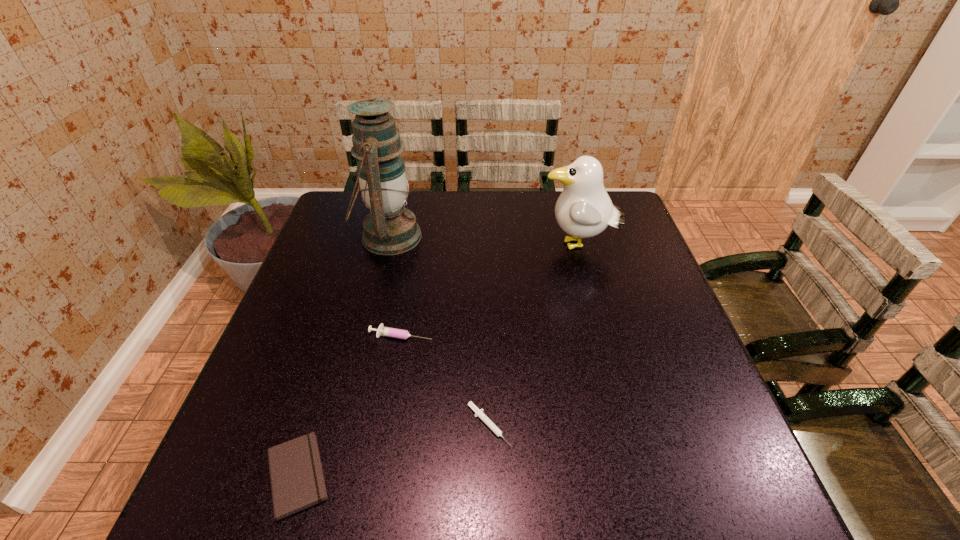
The height and width of the screenshot is (540, 960). In order to click on object present at the right edge in this screenshot , I will do `click(584, 209)`.

The height and width of the screenshot is (540, 960). Identify the location of object positioned at the far left corner. (389, 229).

This screenshot has height=540, width=960. Find the location of `object present at the near left corner`. object present at the near left corner is located at coordinates (297, 482).

The image size is (960, 540). In order to click on object at the far right corner in this screenshot , I will do `click(584, 209)`.

Where is `free space at the far edge`? The height and width of the screenshot is (540, 960). free space at the far edge is located at coordinates [456, 230].

Locate an element on the screen. The image size is (960, 540). vacant space at the left edge of the desktop is located at coordinates (329, 242).

Locate an element on the screen. vacant space at the right edge is located at coordinates (675, 381).

Locate an element on the screen. The height and width of the screenshot is (540, 960). vacant space at the far left corner of the desktop is located at coordinates (333, 214).

What are the coordinates of `free space at the near left corner of the desktop` in the screenshot? It's located at tap(256, 484).

The width and height of the screenshot is (960, 540). Find the location of `free space between the tallest object and the farther syringe`. free space between the tallest object and the farther syringe is located at coordinates (395, 286).